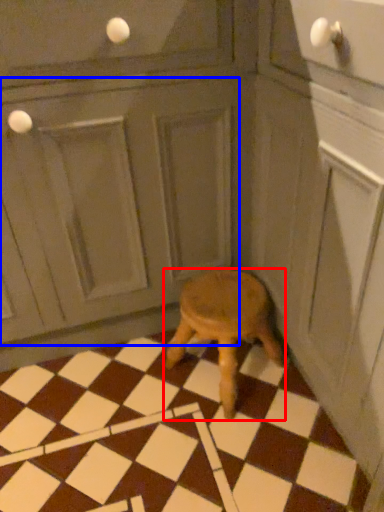
Question: Which point is further to the camera, stool (highlighted by a red box) or screen door (highlighted by a blue box)?

Choices:
 (A) stool
 (B) screen door

Answer: (A)